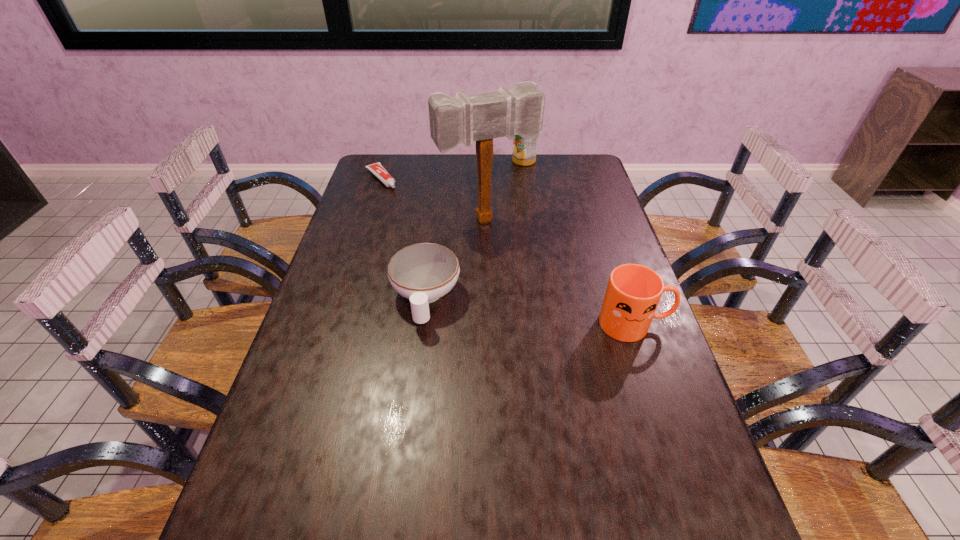
Image resolution: width=960 pixels, height=540 pixels. I want to click on toothpaste at the far edge, so click(x=377, y=169).

Where is `object that is at the left edge`? The width and height of the screenshot is (960, 540). object that is at the left edge is located at coordinates point(377,169).

Where is `object that is at the right edge`? Image resolution: width=960 pixels, height=540 pixels. object that is at the right edge is located at coordinates (633, 292).

This screenshot has width=960, height=540. I want to click on object present at the far left corner, so click(x=377, y=169).

Where is `vacant space at the far edge of the desktop`? Image resolution: width=960 pixels, height=540 pixels. vacant space at the far edge of the desktop is located at coordinates (457, 183).

At what (x,y) coordinates should I click in order to perform the action: click on free region at the near edge. Please return your answer as a coordinate pair (x, y). The image size is (960, 540). Looking at the image, I should click on (616, 514).

Find the location of a particular element. blank space at the left edge is located at coordinates (381, 238).

Where is `vacant space at the right edge of the desktop`? This screenshot has width=960, height=540. vacant space at the right edge of the desktop is located at coordinates (639, 420).

This screenshot has width=960, height=540. Identify the location of free space at the far right corner of the desktop. (580, 163).

You are a GUI agent. You are given a task and a screenshot of the screen. Output one action in this format:
    pyautogui.click(x=<x>, y=<y>)
    Task: Click on the vacant space that is in between the third nearest object and the shortest object
    The width and height of the screenshot is (960, 540).
    Given the screenshot: What is the action you would take?
    pyautogui.click(x=434, y=199)